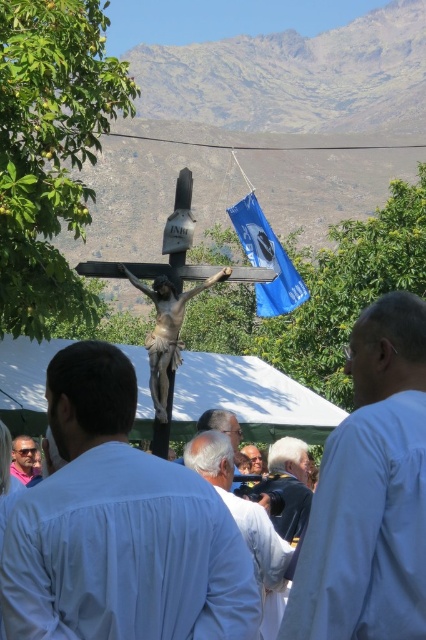
Is white fabric canopy at center shorter than white cotton shirt at center?

Indeed, white fabric canopy at center has a lesser height compared to white cotton shirt at center.

Is point (236, 404) more distant than point (276, 552)?

That is True.

Between point (293, 406) and point (192, 451), which one is positioned behind?

Point (293, 406)

Where is `white fabric canopy at center`? The width and height of the screenshot is (426, 640). white fabric canopy at center is located at coordinates (249, 397).

Does white matte shirt at right lie behind pink fabric sunglasses at lower left?

No, it is not.

How distant is white matte shirt at right from pink fabric sunglasses at lower left?

35.14 meters

Identify the location of white matte shirt at right. This screenshot has width=426, height=640. (371, 492).

In order to click on white matte shirt at right in this screenshot , I will do `click(371, 492)`.

Does white matte shirt at right lie behind white cotton shirt at center?

No, it is in front of white cotton shirt at center.

You are a GUI agent. You are given a task and a screenshot of the screen. Output one action in this format:
    pyautogui.click(x=<x>, y=<y>)
    Task: Click on the white matte shirt at right
    
    Given the screenshot: What is the action you would take?
    pyautogui.click(x=371, y=492)